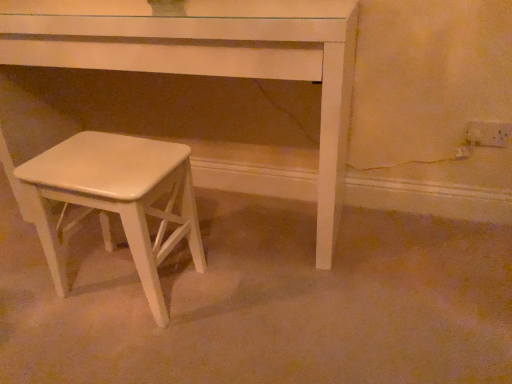
Describe the element at coordinates (208, 57) in the screenshot. I see `white wood stool at lower left` at that location.

This screenshot has height=384, width=512. I want to click on white wood stool at lower left, so click(x=208, y=57).

Measure the distance between white glossy stool at lower left and camera.

99.14 centimeters.

Find the location of a particular element. white glossy stool at lower left is located at coordinates (117, 200).

This screenshot has height=384, width=512. What do you see at coordinates (117, 200) in the screenshot?
I see `white glossy stool at lower left` at bounding box center [117, 200].

Measure the distance between point (x=41, y=165) and camera.

Point (x=41, y=165) and camera are 3.72 feet apart from each other.

You are a GUI agent. You are given a task and a screenshot of the screen. Output one action in this format:
    pyautogui.click(x=<x>, y=<y>)
    Task: Click on the white wood stool at lower left
    This screenshot has width=512, height=384.
    Given the screenshot: What is the action you would take?
    pyautogui.click(x=208, y=57)

Considering the relative positions of white wood stool at lower left and white glossy stool at lower left in the image provided, is white wood stool at lower left to the left of white glossy stool at lower left from the viewer's perspective?

No, white wood stool at lower left is not to the left of white glossy stool at lower left.

Is white wood stool at lower left positioned in front of white glossy stool at lower left?

No, it is not.

Which is closer, (16,57) or (145,268)?

Positioned in front is point (145,268).

From the image's perspective, which is above, white wood stool at lower left or white glossy stool at lower left?

From the image's view, white wood stool at lower left is above.

From a real-world perspective, relative to white glossy stool at lower left, is white wood stool at lower left vertically above or below?

In terms of real-world spatial position, white wood stool at lower left is above white glossy stool at lower left.

Does white wood stool at lower left have a greater width compared to white glossy stool at lower left?

Indeed, white wood stool at lower left has a greater width compared to white glossy stool at lower left.

Is white wood stool at lower left taller or shorter than white glossy stool at lower left?

white wood stool at lower left is taller than white glossy stool at lower left.

Is white wood stool at lower left smaller than white glossy stool at lower left?

No, white wood stool at lower left is not smaller than white glossy stool at lower left.

Could white glossy stool at lower left be considered to be inside white wood stool at lower left?

No, white glossy stool at lower left is not inside white wood stool at lower left.

Is white wood stool at lower left with white glossy stool at lower left?

white wood stool at lower left is not next to white glossy stool at lower left, and they're not touching.

Is white wood stool at lower left looking in the opposite direction of white glossy stool at lower left?

Yes, white wood stool at lower left is positioned with its back facing white glossy stool at lower left.

How much distance is there between white wood stool at lower left and white glossy stool at lower left?

white wood stool at lower left is 16.15 inches away from white glossy stool at lower left.

Where is `table located above the white glossy stool at lower left (from a real-world perspective)`? This screenshot has height=384, width=512. table located above the white glossy stool at lower left (from a real-world perspective) is located at coordinates (208, 57).

Is white glossy stool at lower left to the left of white wood stool at lower left from the viewer's perspective?

Yes, white glossy stool at lower left is to the left of white wood stool at lower left.

Between white glossy stool at lower left and white wood stool at lower left, which one is positioned in front?

Positioned in front is white glossy stool at lower left.

Is point (174, 181) less distant than point (348, 64)?

That is True.

From the image's perspective, between white glossy stool at lower left and white wood stool at lower left, which one is located above?

white wood stool at lower left, from the image's perspective.

From a real-world perspective, between white glossy stool at lower left and white wood stool at lower left, who is vertically higher?

In real-world perspective, white wood stool at lower left is above.

From the picture: Between white glossy stool at lower left and white wood stool at lower left, which one has smaller width?

white glossy stool at lower left is thinner.

Considering the sizes of objects white glossy stool at lower left and white wood stool at lower left in the image provided, who is taller, white glossy stool at lower left or white wood stool at lower left?

white wood stool at lower left is taller.

Considering the sizes of white glossy stool at lower left and white wood stool at lower left in the image, is white glossy stool at lower left bigger or smaller than white wood stool at lower left?

Clearly, white glossy stool at lower left is smaller in size than white wood stool at lower left.

Is white glossy stool at lower left positioned beyond the bounds of white wood stool at lower left?

white glossy stool at lower left is positioned outside white wood stool at lower left.

Is there a large distance between white glossy stool at lower left and white wood stool at lower left?

white glossy stool at lower left is actually quite close to white wood stool at lower left.

Is white glossy stool at lower left oriented towards white wood stool at lower left?

No, white glossy stool at lower left is not facing towards white wood stool at lower left.

What's the angular difference between white glossy stool at lower left and white wood stool at lower left's facing directions?

There is a 0.178-degree angle between the facing directions of white glossy stool at lower left and white wood stool at lower left.

Locate an element on the screen. Image resolution: width=512 pixels, height=384 pixels. table above the white glossy stool at lower left (from the image's perspective) is located at coordinates (208, 57).

The image size is (512, 384). Identify the location of table that is above the white glossy stool at lower left (from a real-world perspective). (208, 57).

Where is `stool below the white wood stool at lower left (from a real-world perspective)`? The width and height of the screenshot is (512, 384). stool below the white wood stool at lower left (from a real-world perspective) is located at coordinates (117, 200).